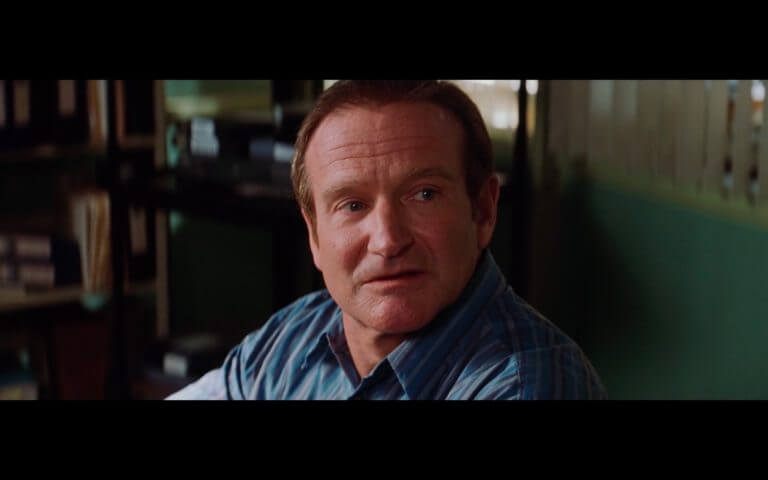
Find the location of a particular element. The width and height of the screenshot is (768, 480). bookshelf is located at coordinates (64, 299), (55, 154).